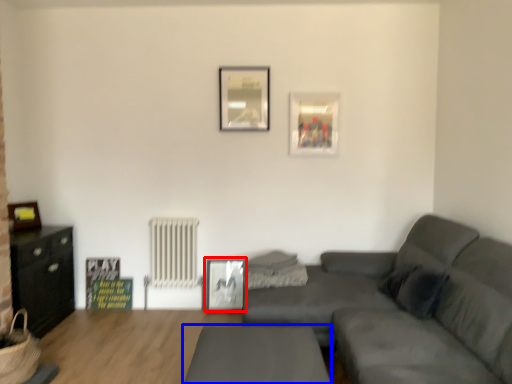
Question: Which of the following is the farthest to the observer, picture frame (highlighted by a red box) or table (highlighted by a blue box)?

Choices:
 (A) picture frame
 (B) table

Answer: (A)